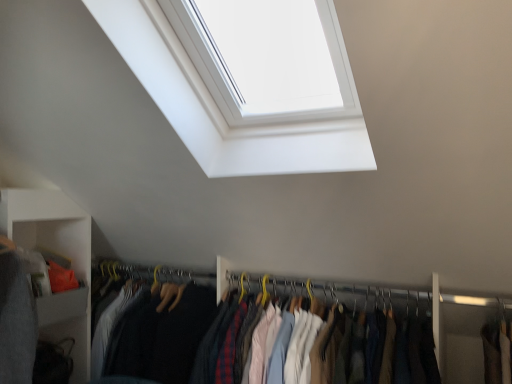
Question: Is yellow metal hanger at center outside matte fabric clothes at center?

Choices:
 (A) yes
 (B) no

Answer: (B)

Question: Does yellow metal hanger at center have a greater height compared to matte fabric clothes at center?

Choices:
 (A) no
 (B) yes

Answer: (A)

Question: Can you see yellow metal hanger at center touching matte fabric clothes at center?

Choices:
 (A) yes
 (B) no

Answer: (B)

Question: From the image's perspective, does yellow metal hanger at center appear lower than matte fabric clothes at center?

Choices:
 (A) yes
 (B) no

Answer: (B)

Question: Can you confirm if yellow metal hanger at center is shorter than matte fabric clothes at center?

Choices:
 (A) no
 (B) yes

Answer: (B)

Question: Is yellow metal hanger at center closer to camera compared to matte fabric clothes at center?

Choices:
 (A) yes
 (B) no

Answer: (B)

Question: Is white matte shelf at lower left not inside matte gray cabinet at lower left?

Choices:
 (A) no
 (B) yes

Answer: (B)

Question: From a real-world perspective, is white matte shelf at lower left positioned over matte gray cabinet at lower left based on gravity?

Choices:
 (A) yes
 (B) no

Answer: (B)

Question: Is white matte shelf at lower left turned away from matte gray cabinet at lower left?

Choices:
 (A) no
 (B) yes

Answer: (B)

Question: Are white matte shelf at lower left and matte gray cabinet at lower left located far from each other?

Choices:
 (A) yes
 (B) no

Answer: (B)

Question: From the image's perspective, is white matte shelf at lower left located above matte gray cabinet at lower left?

Choices:
 (A) yes
 (B) no

Answer: (B)

Question: Can matte gray cabinet at lower left be found inside white matte shelf at lower left?

Choices:
 (A) no
 (B) yes

Answer: (B)

Question: Would you say matte fabric clothes at center is part of white glossy window at upper center's contents?

Choices:
 (A) no
 (B) yes

Answer: (A)